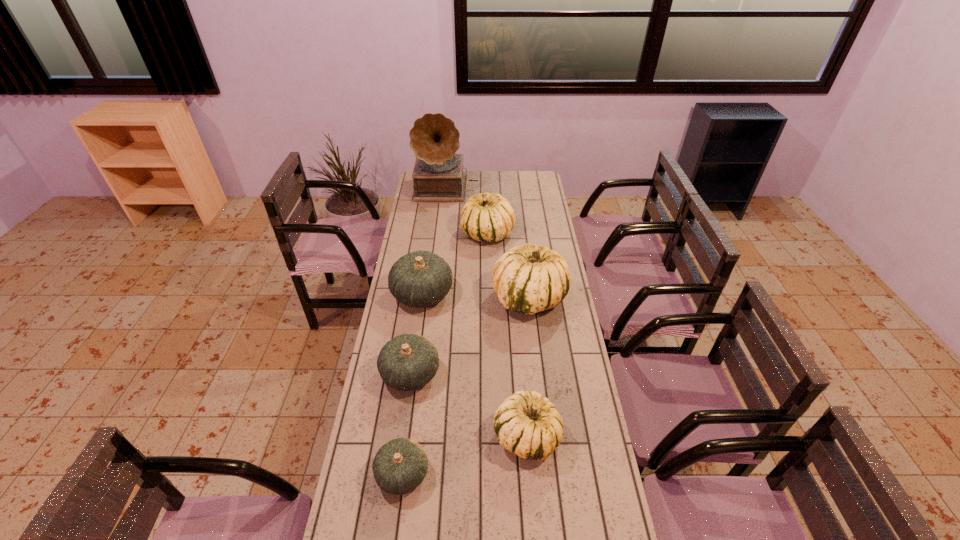
The image size is (960, 540). What are the coordinates of `the shortest object` in the screenshot? It's located at (400, 466).

At what (x,y) coordinates should I click in order to perform the action: click on free point located 0.250m from the horn of the record player. Please return your answer as a coordinate pair (x, y). Looking at the image, I should click on (442, 230).

You are a GUI agent. You are given a task and a screenshot of the screen. Output one action in this format:
    pyautogui.click(x=<x>, y=<y>)
    Task: Click on the vacant point located 0.060m on the back of the biggest white gourd
    
    Given the screenshot: What is the action you would take?
    pyautogui.click(x=525, y=265)

Image resolution: width=960 pixels, height=540 pixels. What are the coordinates of `vacant area located 0.330m on the back of the biggest orange gourd` in the screenshot? It's located at coord(431,231).

Where is `free region located 0.400m on the front of the farthest gourd`? free region located 0.400m on the front of the farthest gourd is located at coordinates (490, 310).

Locate an element on the screen. The width and height of the screenshot is (960, 540). vacant space situated on the right of the second biggest orange gourd is located at coordinates (532, 374).

This screenshot has width=960, height=540. Find the location of `free space located on the right of the smallest white gourd`. free space located on the right of the smallest white gourd is located at coordinates (595, 436).

Locate an element on the screen. The height and width of the screenshot is (540, 960). vacant point located 0.110m on the right of the smallest orange gourd is located at coordinates (466, 474).

What are the coordinates of `object at the far edge` in the screenshot? It's located at (438, 177).

Locate an element on the screen. record player present at the left edge is located at coordinates (438, 177).